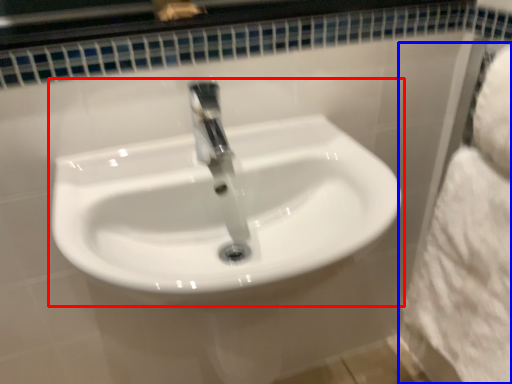
Question: Which object is closer to the camera taking this photo, sink (highlighted by a red box) or bath towel (highlighted by a blue box)?

Choices:
 (A) sink
 (B) bath towel

Answer: (A)